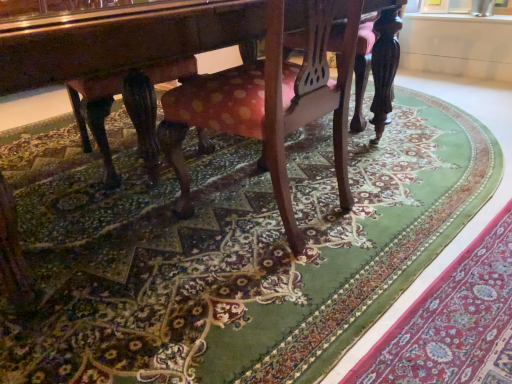
Question: Should I look upward or downward to see green carpet at lower right?

Choices:
 (A) down
 (B) up

Answer: (A)

Question: From a real-world perspective, is polka dot fabric chair at center under green carpet at lower right?

Choices:
 (A) no
 (B) yes

Answer: (A)

Question: Is polka dot fabric chair at center behind green carpet at lower right?

Choices:
 (A) yes
 (B) no

Answer: (A)

Question: Considering the relative sizes of polka dot fabric chair at center and green carpet at lower right in the image provided, is polka dot fabric chair at center bigger than green carpet at lower right?

Choices:
 (A) no
 (B) yes

Answer: (B)

Question: Could you tell me if polka dot fabric chair at center is turned towards green carpet at lower right?

Choices:
 (A) no
 (B) yes

Answer: (A)

Question: From the image's perspective, is polka dot fabric chair at center under green carpet at lower right?

Choices:
 (A) no
 (B) yes

Answer: (A)

Question: Is polka dot fabric chair at center not close to green carpet at lower right?

Choices:
 (A) yes
 (B) no

Answer: (B)

Question: Is green carpet at lower right aimed at polka dot fabric chair at center?

Choices:
 (A) no
 (B) yes

Answer: (A)

Question: Considering the relative sizes of green carpet at lower right and polka dot fabric chair at center in the image provided, is green carpet at lower right thinner than polka dot fabric chair at center?

Choices:
 (A) yes
 (B) no

Answer: (A)

Question: Considering the relative sizes of green carpet at lower right and polka dot fabric chair at center in the image provided, is green carpet at lower right taller than polka dot fabric chair at center?

Choices:
 (A) no
 (B) yes

Answer: (A)

Question: Is polka dot fabric chair at center completely or partially inside green carpet at lower right?

Choices:
 (A) yes
 (B) no

Answer: (B)

Question: Is green carpet at lower right shorter than polka dot fabric chair at center?

Choices:
 (A) yes
 (B) no

Answer: (A)

Question: Is green carpet at lower right looking in the opposite direction of polka dot fabric chair at center?

Choices:
 (A) no
 (B) yes

Answer: (A)

Question: Is point (346, 36) closer or farther from the camera than point (455, 292)?

Choices:
 (A) farther
 (B) closer

Answer: (A)